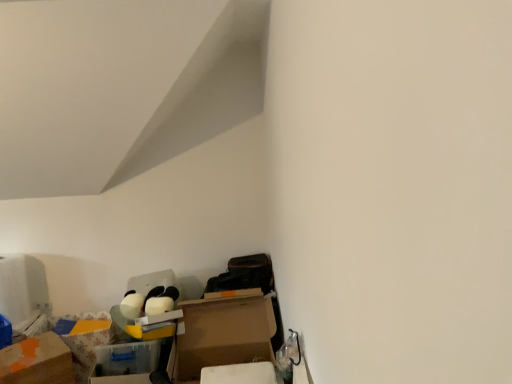
Question: Is cardboard box at lower left, positioned as the 2th cardboard box in left-to-right order, thinner than floral-patterned cardboard box at lower left, the first storage box viewed from the back?

Choices:
 (A) yes
 (B) no

Answer: (B)

Question: Is cardboard box at lower left, positioned as the 2th cardboard box in left-to-right order, outside of floral-patterned cardboard box at lower left, the first storage box viewed from the back?

Choices:
 (A) no
 (B) yes

Answer: (B)

Question: Can you confirm if cardboard box at lower left, arranged as the first cardboard box when viewed from the right, is wider than floral-patterned cardboard box at lower left, which ranks as the 2th storage box in front-to-back order?

Choices:
 (A) yes
 (B) no

Answer: (A)

Question: Is cardboard box at lower left, arranged as the first cardboard box when viewed from the right, smaller than floral-patterned cardboard box at lower left, the first storage box in the left-to-right sequence?

Choices:
 (A) yes
 (B) no

Answer: (B)

Question: From a real-world perspective, does cardboard box at lower left, positioned as the 2th cardboard box in left-to-right order, stand above floral-patterned cardboard box at lower left, the first storage box in the left-to-right sequence?

Choices:
 (A) no
 (B) yes

Answer: (B)

Question: Can you confirm if cardboard box at lower left, arranged as the first cardboard box when viewed from the right, is positioned to the left of floral-patterned cardboard box at lower left, the 2th storage box viewed from the right?

Choices:
 (A) yes
 (B) no

Answer: (B)

Question: From the image's perspective, is translucent plastic storage box at lower left, the 2th storage box viewed from the left, on top of orange matte cardboard box at lower left, the first cardboard box viewed from the left?

Choices:
 (A) no
 (B) yes

Answer: (B)

Question: Considering the relative sizes of translucent plastic storage box at lower left, the first storage box from the right, and orange matte cardboard box at lower left, which appears as the second cardboard box when viewed from the right, in the image provided, is translucent plastic storage box at lower left, the first storage box from the right, shorter than orange matte cardboard box at lower left, which appears as the second cardboard box when viewed from the right,?

Choices:
 (A) yes
 (B) no

Answer: (A)

Question: Is translucent plastic storage box at lower left, the 2th storage box viewed from the left, not inside orange matte cardboard box at lower left, which appears as the second cardboard box when viewed from the right?

Choices:
 (A) no
 (B) yes

Answer: (B)

Question: Does translucent plastic storage box at lower left, which ranks as the 2th storage box in back-to-front order, have a larger size compared to orange matte cardboard box at lower left, which appears as the second cardboard box when viewed from the right?

Choices:
 (A) yes
 (B) no

Answer: (A)

Question: Is translucent plastic storage box at lower left, positioned as the 1th storage box in front-to-back order, positioned with its back to orange matte cardboard box at lower left, which appears as the second cardboard box when viewed from the right?

Choices:
 (A) yes
 (B) no

Answer: (B)

Question: Can orange matte cardboard box at lower left, which appears as the second cardboard box when viewed from the right, be found inside translucent plastic storage box at lower left, the 2th storage box viewed from the left?

Choices:
 (A) no
 (B) yes

Answer: (A)

Question: Does translucent plastic storage box at lower left, the first storage box from the right, turn towards cardboard box at lower left, arranged as the first cardboard box when viewed from the right?

Choices:
 (A) yes
 (B) no

Answer: (B)